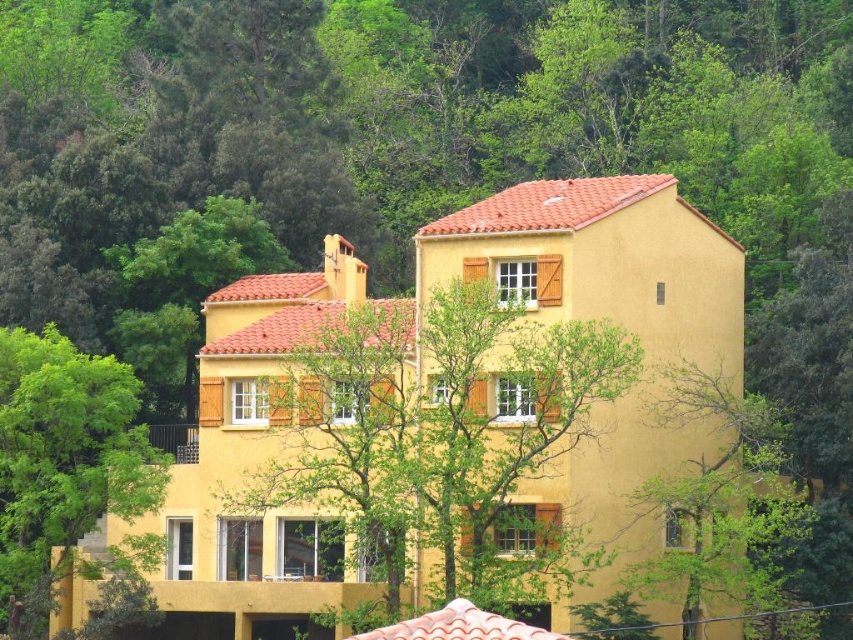
Based on the scene description, which tree is wider between the green leafy tree at center and the green leafy tree at lower left?

The green leafy tree at center is wider than the green leafy tree at lower left according to the description.

You are standing in front of the residential building and want to determine the arrangement of the trees. Which tree, the green leafy tree at center or the green leafy tree at lower left, is positioned closer to you?

The green leafy tree at center is closer to the viewer than the green leafy tree at lower left.